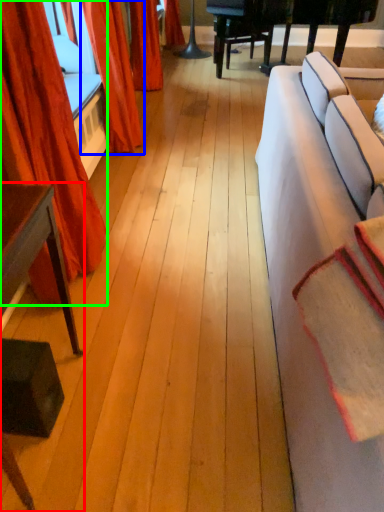
Question: Which object is the closest to the table (highlighted by a red box)? Choose among these: curtain (highlighted by a blue box) or curtain (highlighted by a green box).

Choices:
 (A) curtain
 (B) curtain

Answer: (B)